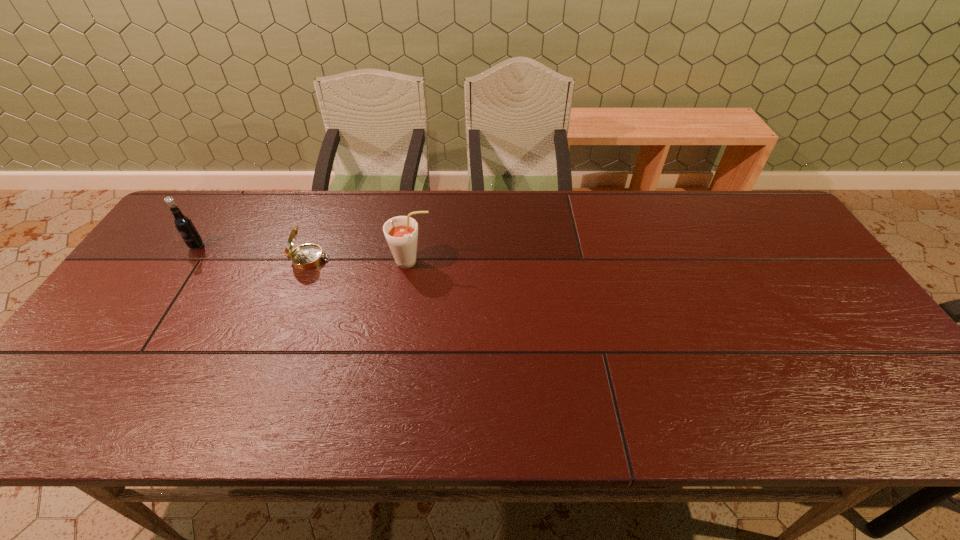
The width and height of the screenshot is (960, 540). Find the location of `vacant area between the second object from right to left and the nearer root beer`. vacant area between the second object from right to left and the nearer root beer is located at coordinates (361, 261).

Find the location of a particular element. vacant space in between the right root beer and the second object from right to left is located at coordinates (361, 261).

Identify the location of object that stands as the closest to the compass. This screenshot has width=960, height=540. (401, 232).

Identify which object is the second nearest to the compass. Please provide its 2D coordinates. Your answer should be formatted as a tuple, i.e. [(x, y)], where the tuple contains the x and y coordinates of a point satisfying the conditions above.

[(183, 224)]